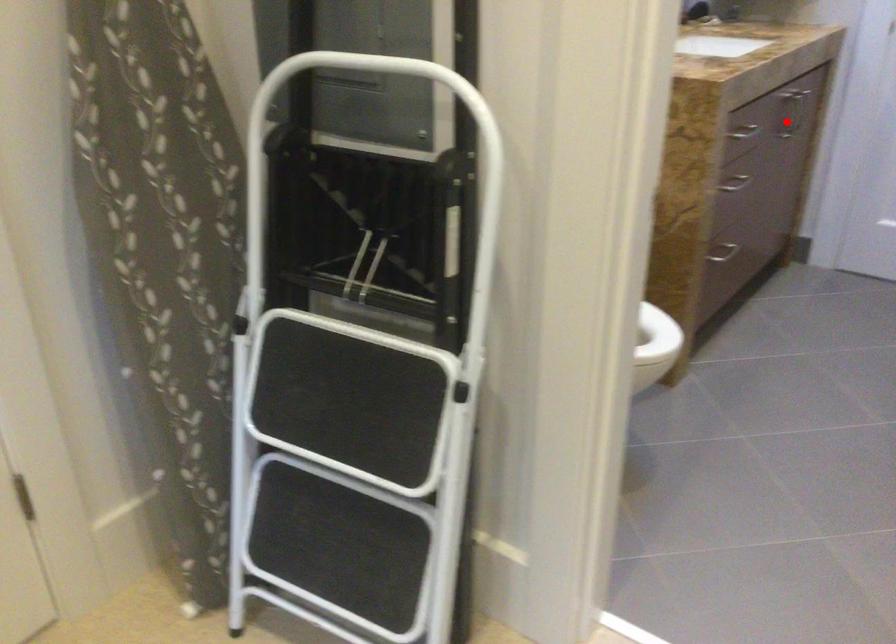
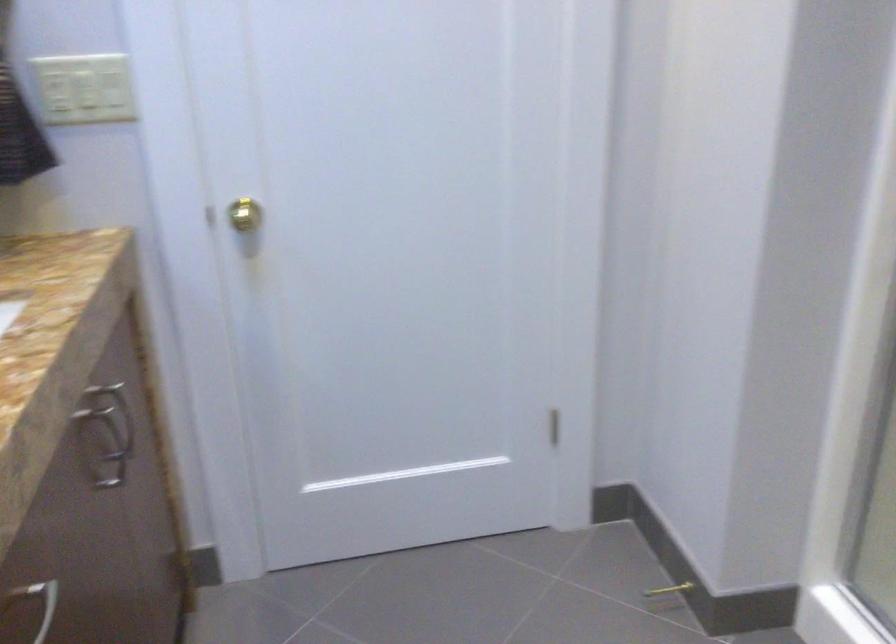
Question: I am providing you with two images of the same scene from different viewpoints. Given a red point in image1, look at the same physical point in image2. Is it:

Choices:
 (A) Closer to the viewpoint
 (B) Farther from the viewpoint

Answer: (A)